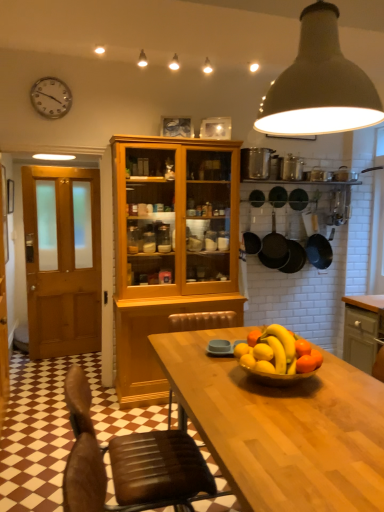
Question: Considering the relative sizes of matte gray cabinet at right and shiny golden bowl at center in the image provided, is matte gray cabinet at right taller than shiny golden bowl at center?

Choices:
 (A) no
 (B) yes

Answer: (B)

Question: Is shiny golden bowl at center inside matte gray cabinet at right?

Choices:
 (A) yes
 (B) no

Answer: (B)

Question: Can you confirm if matte gray cabinet at right is wider than shiny golden bowl at center?

Choices:
 (A) yes
 (B) no

Answer: (A)

Question: From a real-world perspective, is matte gray cabinet at right positioned over shiny golden bowl at center based on gravity?

Choices:
 (A) yes
 (B) no

Answer: (B)

Question: Does matte gray cabinet at right turn towards shiny golden bowl at center?

Choices:
 (A) yes
 (B) no

Answer: (B)

Question: Considering the relative sizes of matte gray cabinet at right and shiny golden bowl at center in the image provided, is matte gray cabinet at right smaller than shiny golden bowl at center?

Choices:
 (A) yes
 (B) no

Answer: (B)

Question: Does matte gray cabinet at right have a lesser width compared to silver metallic clock at upper left?

Choices:
 (A) yes
 (B) no

Answer: (B)

Question: Does matte gray cabinet at right have a greater width compared to silver metallic clock at upper left?

Choices:
 (A) yes
 (B) no

Answer: (A)

Question: Is matte gray cabinet at right shorter than silver metallic clock at upper left?

Choices:
 (A) no
 (B) yes

Answer: (A)

Question: Can you confirm if matte gray cabinet at right is bigger than silver metallic clock at upper left?

Choices:
 (A) no
 (B) yes

Answer: (B)

Question: Is matte gray cabinet at right aimed at silver metallic clock at upper left?

Choices:
 (A) yes
 (B) no

Answer: (B)

Question: Can you confirm if matte gray cabinet at right is positioned to the right of silver metallic clock at upper left?

Choices:
 (A) yes
 (B) no

Answer: (A)

Question: Does white matte pendant light at upper center appear on the right side of matte gray cabinet at right?

Choices:
 (A) no
 (B) yes

Answer: (A)